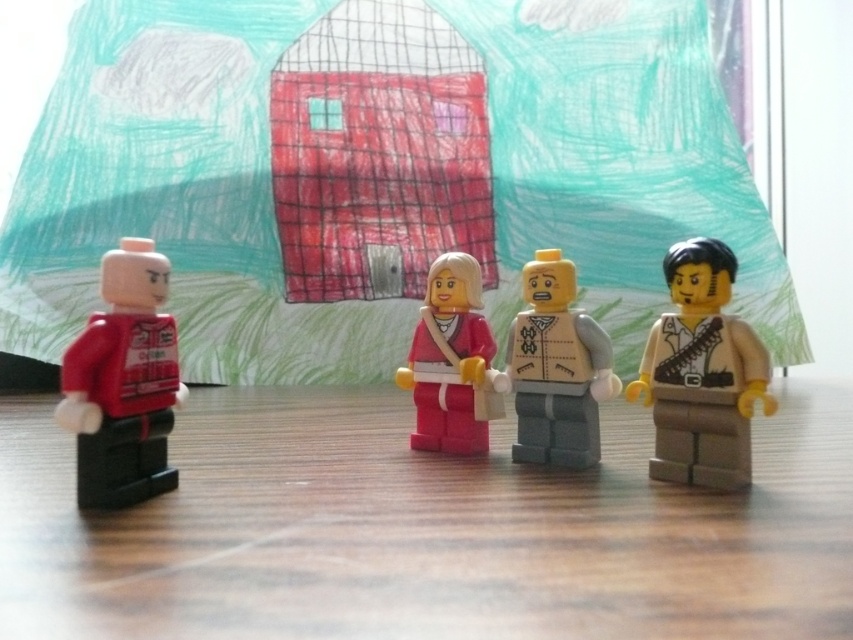
You are a photographer setting up a shot of the wooden table at center and the pink matte figure at center. Which object will appear larger in your photo?

The wooden table at center will appear larger in the photo because it is closer to the viewer than the pink matte figure at center.

You are a toy organizer trying to stack these items. Can the wooden table at center support the pink matte figure at center without toppling over?

The wooden table at center has a lesser height compared to pink matte figure at center, so the table might not provide enough stability to support the pink matte figure at center without toppling over due to the height difference.